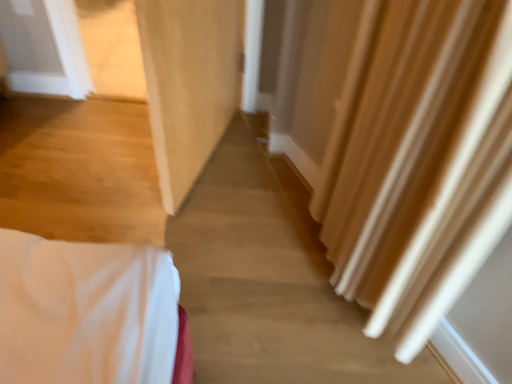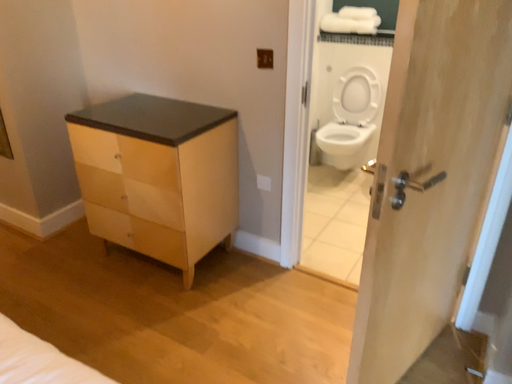
Question: How did the camera likely rotate when shooting the video?

Choices:
 (A) rotated downward
 (B) rotated upward

Answer: (B)